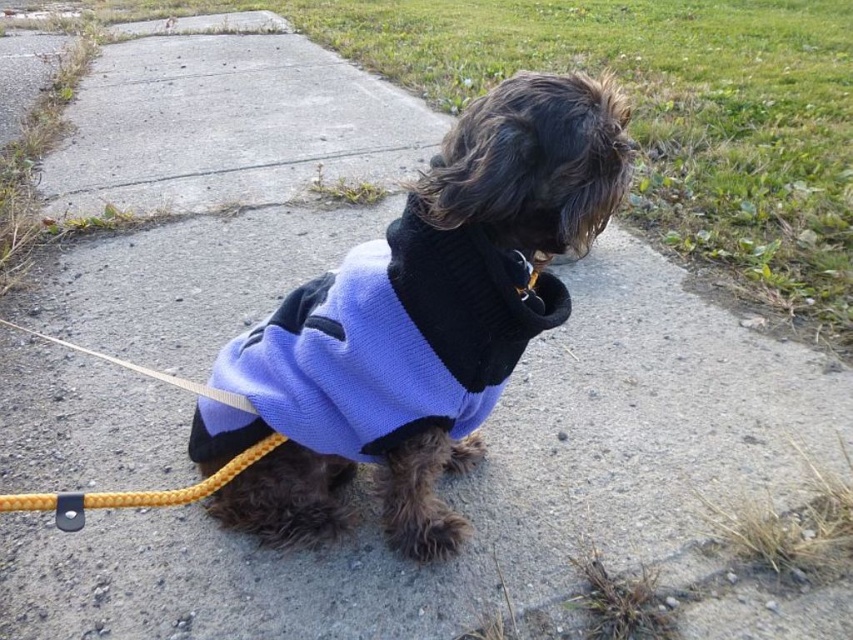
This screenshot has height=640, width=853. What do you see at coordinates (419, 321) in the screenshot?
I see `knitted blue sweater at center` at bounding box center [419, 321].

What do you see at coordinates (419, 321) in the screenshot? I see `knitted blue sweater at center` at bounding box center [419, 321].

Where is `knitted blue sweater at center`? This screenshot has height=640, width=853. knitted blue sweater at center is located at coordinates (419, 321).